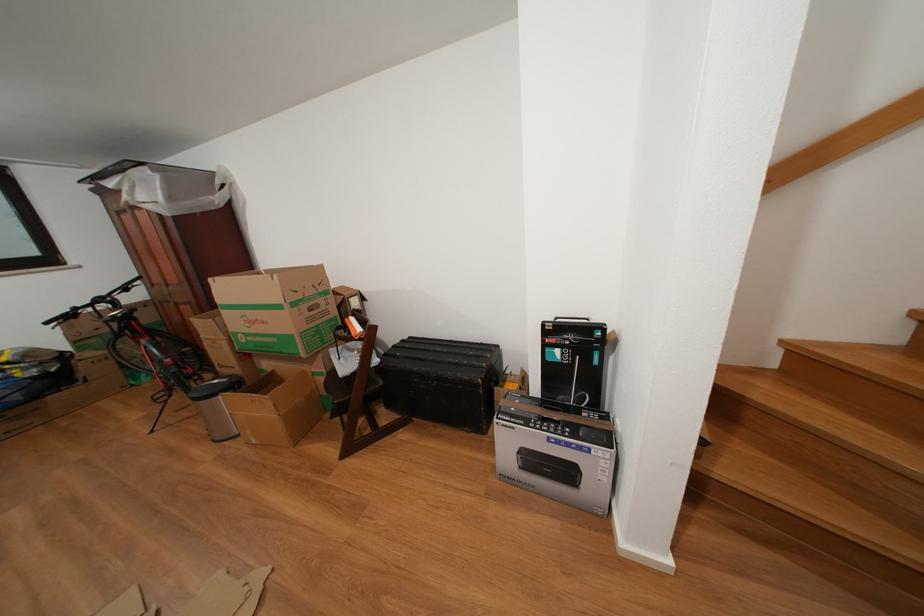
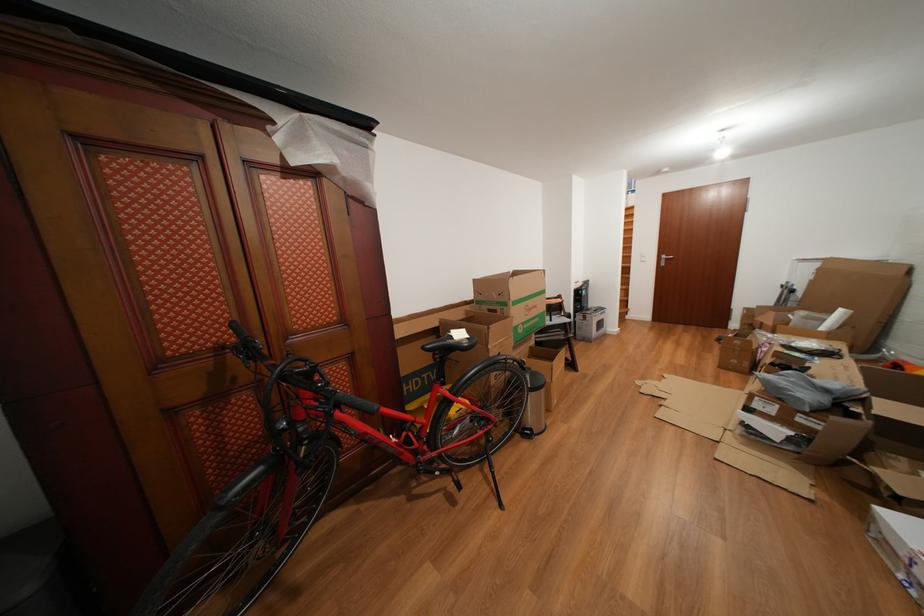
The point at [272,328] is marked in the first image. Where is the corresponding point in the second image?

(543, 312)